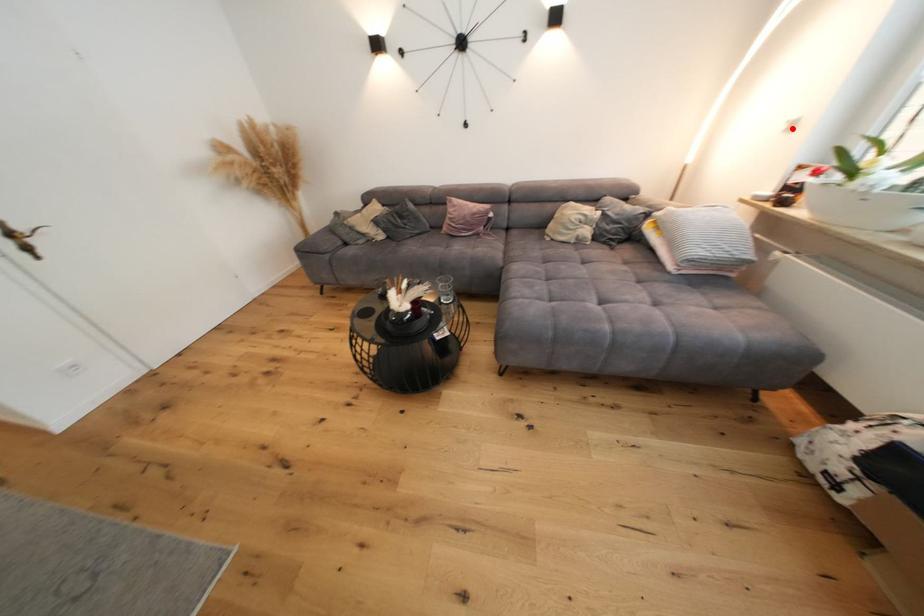
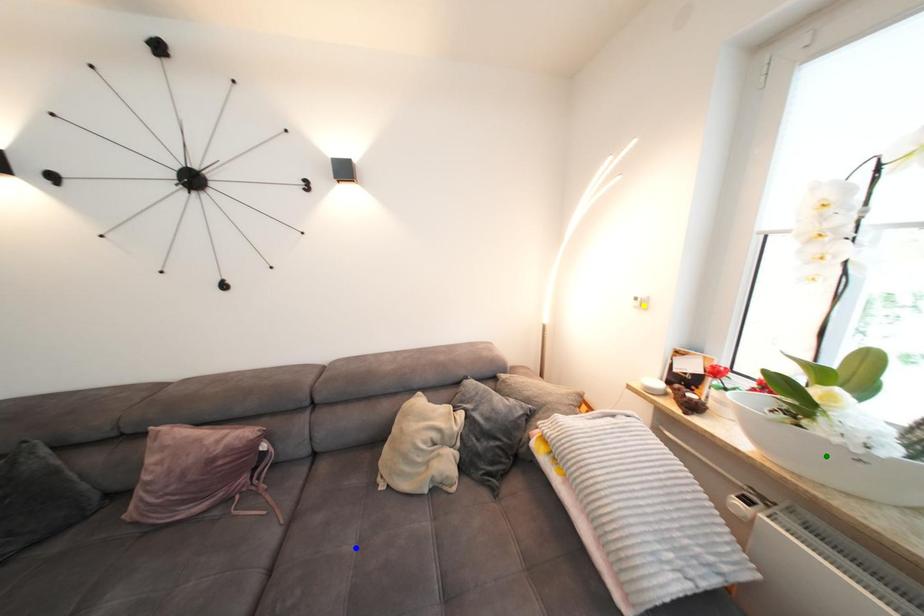
Question: I am providing you with two images of the same scene from different viewpoints. A red point is marked on the first image. You are given multiple points on the second image. In image 2, which mark is for the same physical point as the one in image 1?

Choices:
 (A) blue point
 (B) yellow point
 (C) green point

Answer: (B)